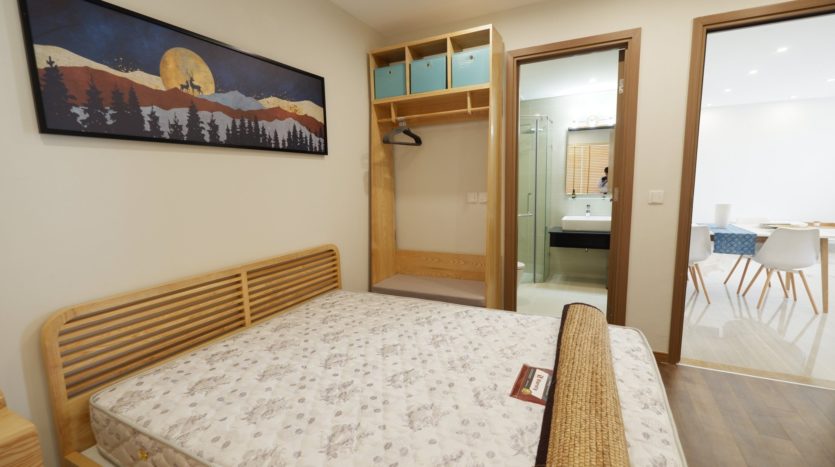
Find the location of a particular element. This screenshot has height=467, width=835. mattress is located at coordinates (491, 417).